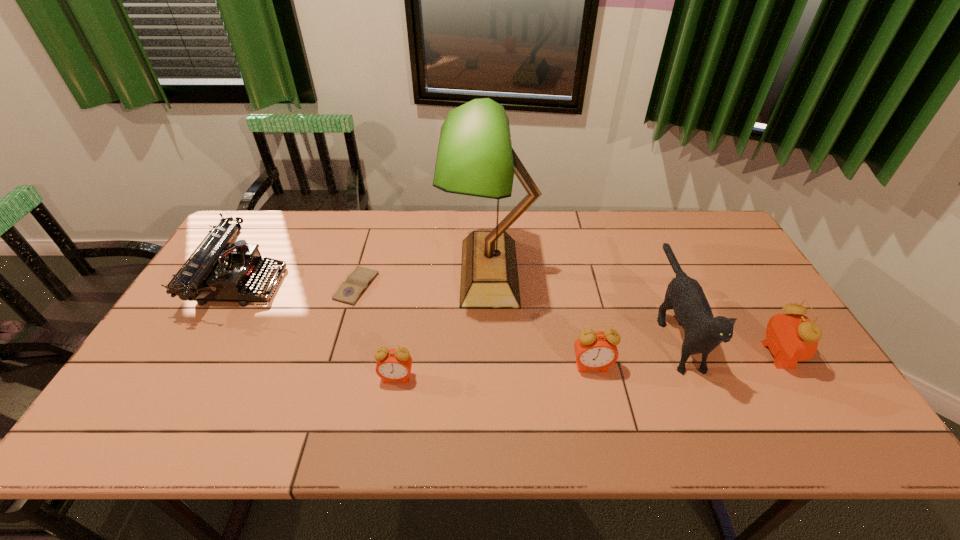
This screenshot has height=540, width=960. Identify the location of cat positioned at the near edge. point(703,332).

Image resolution: width=960 pixels, height=540 pixels. Find the location of `object present at the left edge`. object present at the left edge is located at coordinates (223, 269).

Where is `object located in the right edge section of the desktop`? The image size is (960, 540). object located in the right edge section of the desktop is located at coordinates (793, 337).

At what (x,y) coordinates should I click in order to perform the action: click on object at the far left corner. Please return your answer as a coordinate pair (x, y). Looking at the image, I should click on (223, 269).

Image resolution: width=960 pixels, height=540 pixels. I want to click on object located at the near right corner, so click(793, 337).

Where is `free space at the far edge of the desktop`? free space at the far edge of the desktop is located at coordinates (477, 222).

You are a GUI agent. You are given a task and a screenshot of the screen. Output one action in this format:
    pyautogui.click(x=<x>, y=<y>)
    Task: Click on the free space at the near edge of the desktop
    
    Given the screenshot: What is the action you would take?
    pyautogui.click(x=756, y=382)

In the image, there is a desktop. Where is `vacant space at the left edge`? This screenshot has width=960, height=540. vacant space at the left edge is located at coordinates (215, 361).

At what (x,y) coordinates should I click in order to perform the action: click on vacant space at the right edge of the desktop. Please return your answer as a coordinate pair (x, y). The height and width of the screenshot is (540, 960). Looking at the image, I should click on (748, 336).

This screenshot has width=960, height=540. In order to click on empty space between the sixth object from left to right and the second shortest alarm clock in this screenshot , I will do `click(633, 346)`.